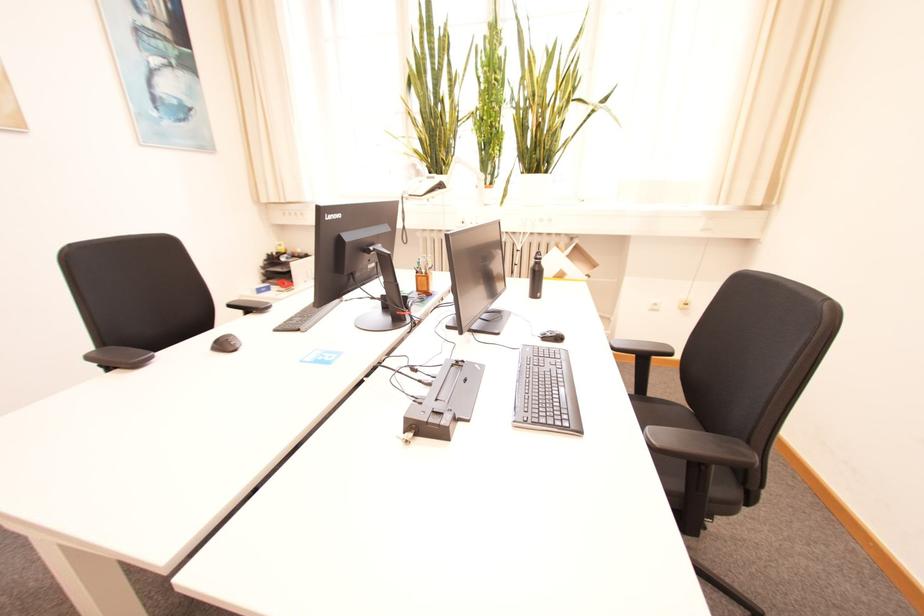
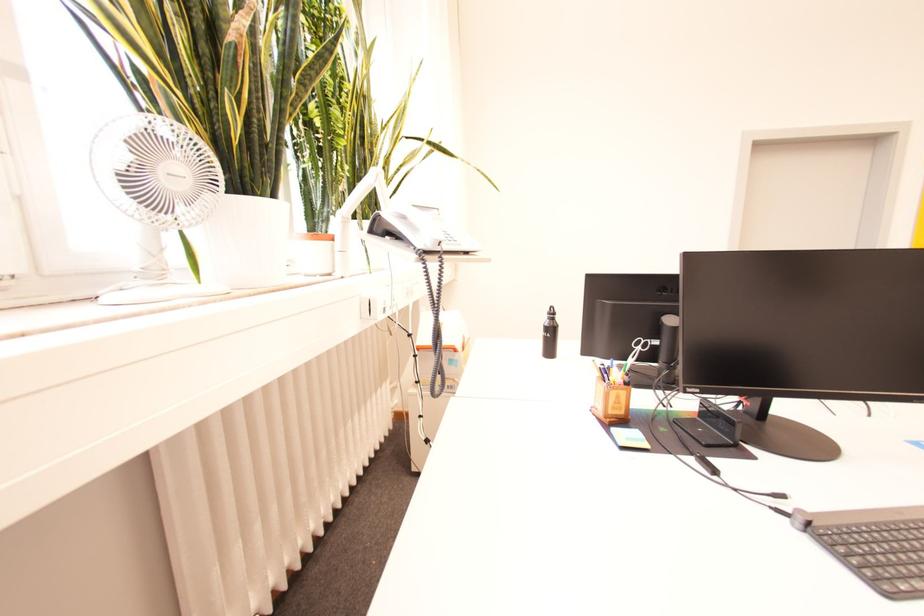
Question: I am providing you with two images of the same scene from different viewpoints. Which of the following objects are not visible in image2?

Choices:
 (A) cabinet drawer handle
 (B) black water bottle
 (C) black keyboard
 (D) grey sleeping bag

Answer: (C)